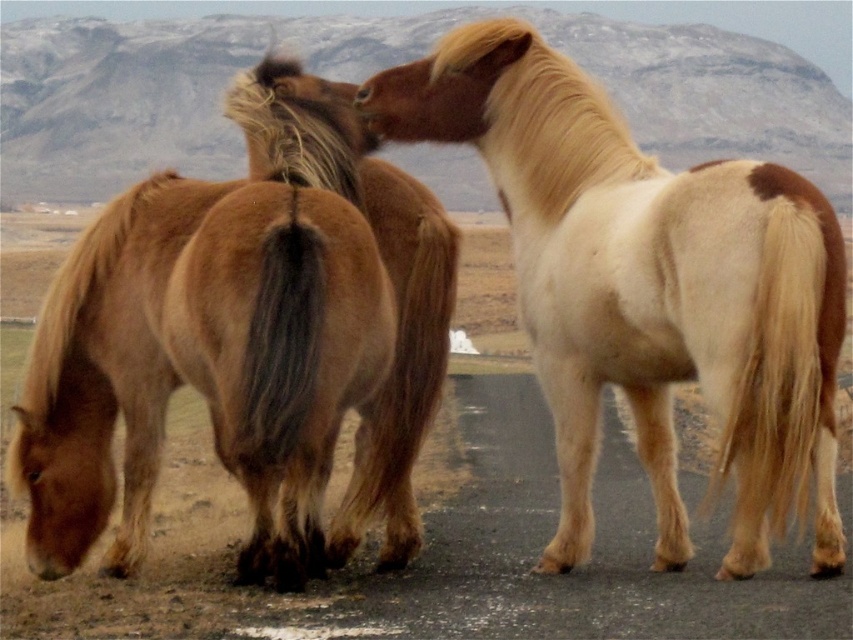
Question: Is light brown fur at center positioned at the back of brown fur at center?

Choices:
 (A) yes
 (B) no

Answer: (B)

Question: Which object appears closest to the camera in this image?

Choices:
 (A) brown fur at center
 (B) light brown fur at center

Answer: (B)

Question: Considering the real-world distances, which object is closest to the brown fuzzy horse at left?

Choices:
 (A) white-brown fur horse at center
 (B) light brown fur at center
 (C) brown fur at center

Answer: (B)

Question: Where is white-brown fur horse at center located in relation to brown fuzzy horse at left in the image?

Choices:
 (A) above
 (B) below

Answer: (A)

Question: Which object is farther from the camera taking this photo?

Choices:
 (A) light brown fur at center
 (B) white-brown fur horse at center

Answer: (B)

Question: Is brown fuzzy horse at left wider than light brown fur at center?

Choices:
 (A) no
 (B) yes

Answer: (A)